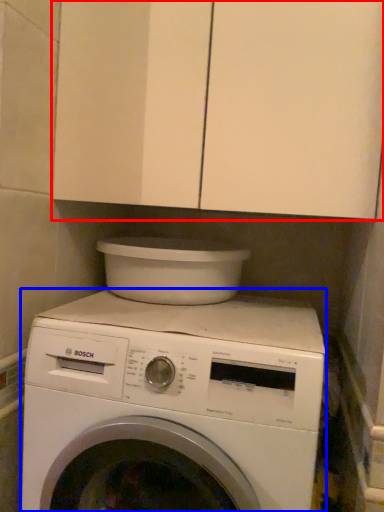
Question: Which object is closer to the camera taking this photo, cabinetry (highlighted by a red box) or washing machine (highlighted by a blue box)?

Choices:
 (A) cabinetry
 (B) washing machine

Answer: (B)